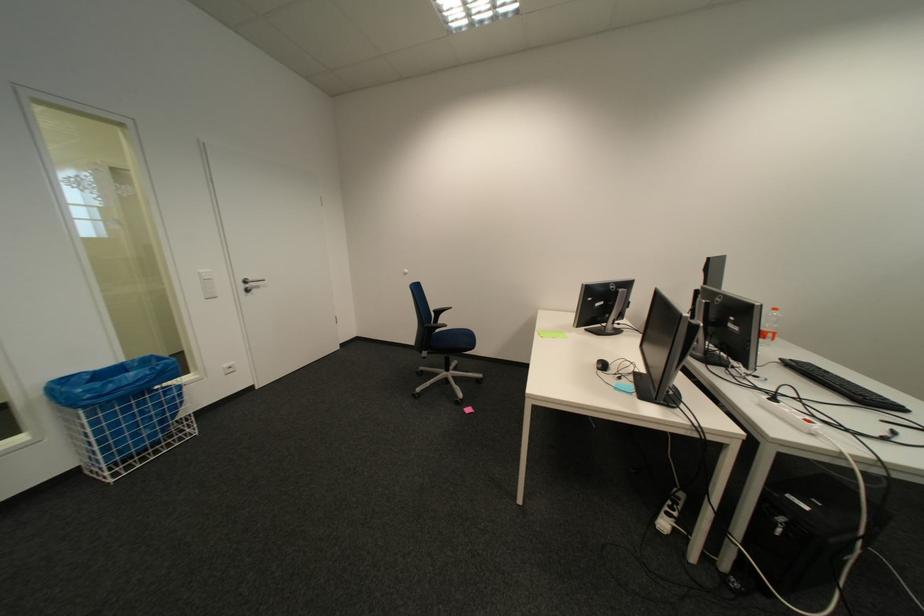
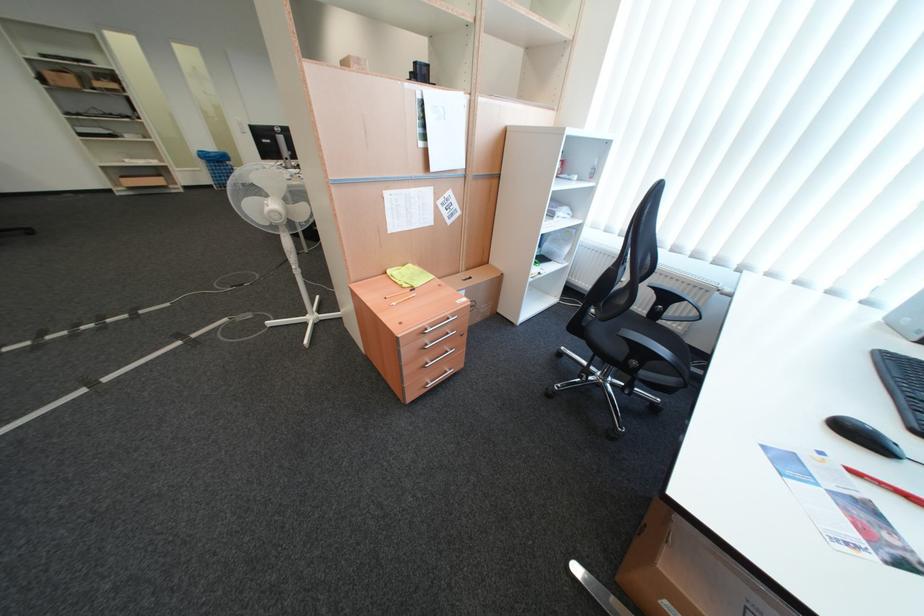
Find the pixel in the second image that matches (x=139, y=411) in the first image.

(227, 168)